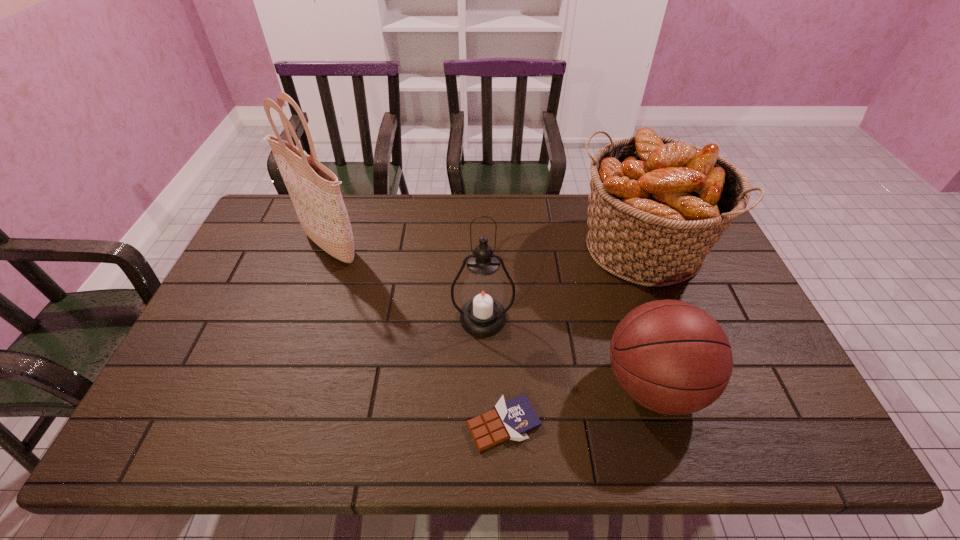
Locate an element on the screen. Image resolution: width=960 pixels, height=540 pixels. free location located on the right of the chocolate bar is located at coordinates (610, 424).

You are a GUI agent. You are given a task and a screenshot of the screen. Output one action in this format:
    pyautogui.click(x=<x>, y=<y>)
    Task: Click on the shopping bag present at the far edge
    The image size is (960, 540).
    Given the screenshot: What is the action you would take?
    pyautogui.click(x=314, y=190)

You are a GUI agent. You are given a task and a screenshot of the screen. Output one action in this format:
    pyautogui.click(x=<x>, y=<y>)
    Task: Click on the basket situated at the far edge
    
    Given the screenshot: What is the action you would take?
    pyautogui.click(x=657, y=205)

Find the location of `basketball present at the near edge`. basketball present at the near edge is located at coordinates (671, 357).

This screenshot has width=960, height=540. I want to click on chocolate bar positioned at the near edge, so click(512, 419).

Identify the location of object that is at the left edge. (314, 190).

Locate an element on the screen. This screenshot has height=540, width=960. object at the right edge is located at coordinates (657, 205).

Locate an element on the screen. This screenshot has width=960, height=540. object at the far left corner is located at coordinates (314, 190).

Identify the location of object that is at the far right corner. (657, 205).

The width and height of the screenshot is (960, 540). In order to click on vacant space at the far edge of the desktop in this screenshot , I will do `click(467, 234)`.